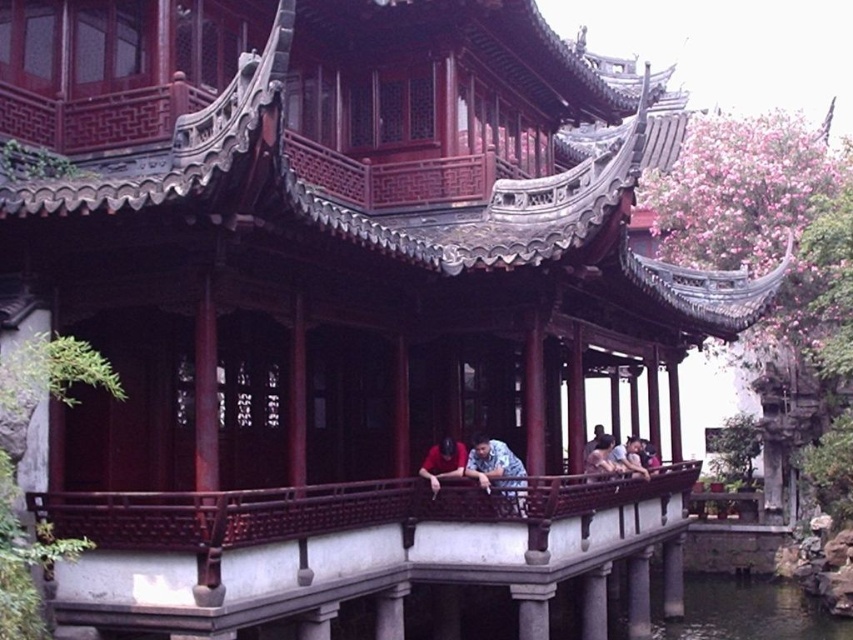
Which is in front, point (515, 464) or point (611, 445)?

Positioned in front is point (515, 464).

Between point (503, 492) and point (607, 452), which one is positioned behind?

Point (607, 452)

Find the location of a particular element. printed fabric shirt at center is located at coordinates (498, 474).

Does matte blue shirt at center have a smaller size compared to light blue fabric shirt at center?

Incorrect, matte blue shirt at center is not smaller in size than light blue fabric shirt at center.

Is the position of matte blue shirt at center less distant than that of light blue fabric shirt at center?

That is True.

Looking at this image, who is more distant from viewer, [461,442] or [607,465]?

The point [607,465] is more distant.

At what (x,y) coordinates should I click in order to perform the action: click on matte blue shirt at center. Please return your answer as a coordinate pair (x, y). This screenshot has height=640, width=853. Looking at the image, I should click on (444, 461).

Between point (602, 468) and point (625, 456), which one is positioned in front?

Point (602, 468) is more forward.

Between light blue fabric shirt at center and light brown wooden bench at center, which one is positioned higher?

light blue fabric shirt at center is higher up.

Between point (612, 474) and point (641, 468), which one is positioned in front?

Positioned in front is point (612, 474).

Identify the location of light blue fabric shirt at center. pyautogui.click(x=602, y=460).